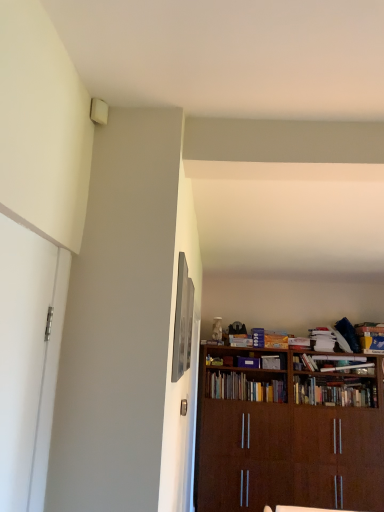
Image resolution: width=384 pixels, height=512 pixels. Find the location of `blue cardboard book at right, arranged as the fourth book when viewed from the left`. blue cardboard book at right, arranged as the fourth book when viewed from the left is located at coordinates (371, 337).

This screenshot has height=512, width=384. What do you see at coordinates (371, 337) in the screenshot? I see `blue cardboard book at right, arranged as the fourth book when viewed from the left` at bounding box center [371, 337].

What do you see at coordinates (289, 432) in the screenshot?
I see `brown wooden bookcase at lower right` at bounding box center [289, 432].

The height and width of the screenshot is (512, 384). What are the coordinates of `hardcover book at center, positioned as the second book in right-to-left order` in the screenshot? It's located at (334, 362).

Where is `wooden bookshelf at center, the 3th book from the right`? Image resolution: width=384 pixels, height=512 pixels. wooden bookshelf at center, the 3th book from the right is located at coordinates (335, 392).

The width and height of the screenshot is (384, 512). Find the location of `hardcover books at center, which appears as the fourth book when viewed from the right`. hardcover books at center, which appears as the fourth book when viewed from the right is located at coordinates (244, 388).

From the picture: Is hardcover books at center, the first book when ordered from left to right, facing away from brown wooden bookcase at lower right?

Yes, brown wooden bookcase at lower right is at the back of hardcover books at center, the first book when ordered from left to right.

Is point (263, 397) closer or farther from the camera than point (287, 432)?

Point (263, 397) is farther from the camera than point (287, 432).

Which of these two, hardcover books at center, the first book when ordered from left to right, or brown wooden bookcase at lower right, stands taller?

brown wooden bookcase at lower right.

How many degrees apart are the facing directions of wooden bookshelf at center, the 3th book from the right, and matte silver picture frame at upper center?

91.4 degrees separate the facing orientations of wooden bookshelf at center, the 3th book from the right, and matte silver picture frame at upper center.

From the image's perspective, is wooden bookshelf at center, the 2th book viewed from the left, located above or below matte silver picture frame at upper center?

Clearly, from the image's perspective, wooden bookshelf at center, the 2th book viewed from the left, is below matte silver picture frame at upper center.

From a real-world perspective, which object rests below the other?

wooden bookshelf at center, the 2th book viewed from the left, is physically lower.

Could you tell me if blue cardboard book at right, which is the 1th book in right-to-left order, is facing hardcover books at center, which appears as the fourth book when viewed from the right?

No.

From the image's perspective, between blue cardboard book at right, which is the 1th book in right-to-left order, and hardcover books at center, the first book when ordered from left to right, who is located below?

hardcover books at center, the first book when ordered from left to right.

Is blue cardboard book at right, which is the 1th book in right-to-left order, positioned far away from hardcover books at center, the first book when ordered from left to right?

Yes.

Between hardcover books at center, the first book when ordered from left to right, and matte silver picture frame at upper center, which one has larger size?

Bigger between the two is hardcover books at center, the first book when ordered from left to right.

Between hardcover books at center, the first book when ordered from left to right, and matte silver picture frame at upper center, which one appears on the left side from the viewer's perspective?

matte silver picture frame at upper center.

Find the location of `the 3rd book behind the matte silver picture frame at upper center, starting your count from the anchor`. the 3rd book behind the matte silver picture frame at upper center, starting your count from the anchor is located at coordinates (244, 388).

From the image's perspective, which one is positioned lower, hardcover books at center, which appears as the fourth book when viewed from the right, or wooden bookshelf at center, the 2th book viewed from the left?

wooden bookshelf at center, the 2th book viewed from the left, appears lower in the image.

Does hardcover books at center, the first book when ordered from left to right, turn towards wooden bookshelf at center, the 2th book viewed from the left?

No, hardcover books at center, the first book when ordered from left to right, is not facing towards wooden bookshelf at center, the 2th book viewed from the left.

Is hardcover books at center, which appears as the fourth book when viewed from the right, bigger than wooden bookshelf at center, the 2th book viewed from the left?

No.

Is blue cardboard book at right, arranged as the fourth book when viewed from the left, aimed at hardcover book at center, which is counted as the third book, starting from the left?

No, blue cardboard book at right, arranged as the fourth book when viewed from the left, is not aimed at hardcover book at center, which is counted as the third book, starting from the left.

Consider the image. Would you say blue cardboard book at right, arranged as the fourth book when viewed from the left, contains hardcover book at center, positioned as the second book in right-to-left order?

No, hardcover book at center, positioned as the second book in right-to-left order, is not a part of blue cardboard book at right, arranged as the fourth book when viewed from the left.

How much distance is there between hardcover books at center, the first book when ordered from left to right, and hardcover book at center, positioned as the second book in right-to-left order?

The distance of hardcover books at center, the first book when ordered from left to right, from hardcover book at center, positioned as the second book in right-to-left order, is 27.20 inches.

From the image's perspective, is hardcover books at center, the first book when ordered from left to right, on top of hardcover book at center, positioned as the second book in right-to-left order?

Actually, hardcover books at center, the first book when ordered from left to right, appears below hardcover book at center, positioned as the second book in right-to-left order, in the image.

In the scene shown: Considering the relative sizes of hardcover books at center, which appears as the fourth book when viewed from the right, and hardcover book at center, positioned as the second book in right-to-left order, in the image provided, is hardcover books at center, which appears as the fourth book when viewed from the right, bigger than hardcover book at center, positioned as the second book in right-to-left order,?

Indeed, hardcover books at center, which appears as the fourth book when viewed from the right, has a larger size compared to hardcover book at center, positioned as the second book in right-to-left order.

Is hardcover books at center, the first book when ordered from left to right, oriented towards hardcover book at center, positioned as the second book in right-to-left order?

No, hardcover books at center, the first book when ordered from left to right, does not turn towards hardcover book at center, positioned as the second book in right-to-left order.

From the brown wooden bookcase at lower right, count 3rd books backward and point to it. Please provide its 2D coordinates.

[(244, 388)]

The height and width of the screenshot is (512, 384). I want to click on picture frame above the wooden bookshelf at center, the 3th book from the right (from the image's perspective), so click(182, 321).

Considering their positions, is blue cardboard book at right, arranged as the fourth book when viewed from the left, positioned further to matte silver picture frame at upper center than hardcover book at center, positioned as the second book in right-to-left order?

blue cardboard book at right, arranged as the fourth book when viewed from the left, is positioned further to the anchor matte silver picture frame at upper center.

Based on their spatial positions, is hardcover books at center, which appears as the fourth book when viewed from the right, or blue cardboard book at right, arranged as the fourth book when viewed from the left, further from matte silver picture frame at upper center?

Among the two, blue cardboard book at right, arranged as the fourth book when viewed from the left, is located further to matte silver picture frame at upper center.

Estimate the real-world distances between objects in this image. Which object is further from wooden bookshelf at center, the 2th book viewed from the left, blue cardboard book at right, arranged as the fourth book when viewed from the left, or matte silver picture frame at upper center?

Among the two, matte silver picture frame at upper center is located further to wooden bookshelf at center, the 2th book viewed from the left.

From the image, which object appears to be nearer to matte silver picture frame at upper center, brown wooden bookcase at lower right or hardcover books at center, which appears as the fourth book when viewed from the right?

hardcover books at center, which appears as the fourth book when viewed from the right, lies closer to matte silver picture frame at upper center than the other object.

Based on the photo, which object lies nearer to the anchor point hardcover book at center, positioned as the second book in right-to-left order, hardcover books at center, the first book when ordered from left to right, or wooden bookshelf at center, the 2th book viewed from the left?

wooden bookshelf at center, the 2th book viewed from the left, is positioned closer to the anchor hardcover book at center, positioned as the second book in right-to-left order.

When comparing their distances from blue cardboard book at right, which is the 1th book in right-to-left order, does brown wooden bookcase at lower right or hardcover book at center, which is counted as the third book, starting from the left, seem closer?

hardcover book at center, which is counted as the third book, starting from the left, is closer to blue cardboard book at right, which is the 1th book in right-to-left order.

When comparing their distances from brown wooden bookcase at lower right, does blue cardboard book at right, arranged as the fourth book when viewed from the left, or wooden bookshelf at center, the 2th book viewed from the left, seem further?

The object further to brown wooden bookcase at lower right is blue cardboard book at right, arranged as the fourth book when viewed from the left.

From the picture: Based on their spatial positions, is hardcover books at center, the first book when ordered from left to right, or brown wooden bookcase at lower right further from matte silver picture frame at upper center?

Based on the image, brown wooden bookcase at lower right appears to be further to matte silver picture frame at upper center.

Where is `bookcase located between matte silver picture frame at upper center and hardcover book at center, which is counted as the third book, starting from the left, in the depth direction`? Image resolution: width=384 pixels, height=512 pixels. bookcase located between matte silver picture frame at upper center and hardcover book at center, which is counted as the third book, starting from the left, in the depth direction is located at coordinates (289, 432).

You are a GUI agent. You are given a task and a screenshot of the screen. Output one action in this format:
    pyautogui.click(x=<x>, y=<y>)
    Task: Click on the bookcase located between hardcover books at center, the first book when ordered from left to right, and blue cardboard book at right, arranged as the fourth book when viewed from the left, in the left-right direction
    This screenshot has width=384, height=512.
    Given the screenshot: What is the action you would take?
    pyautogui.click(x=289, y=432)

Find the location of a particular element. The width and height of the screenshot is (384, 512). bookcase between matte silver picture frame at upper center and blue cardboard book at right, which is the 1th book in right-to-left order, from front to back is located at coordinates click(289, 432).

Image resolution: width=384 pixels, height=512 pixels. I want to click on book between wooden bookshelf at center, the 2th book viewed from the left, and blue cardboard book at right, arranged as the fourth book when viewed from the left, so click(x=334, y=362).